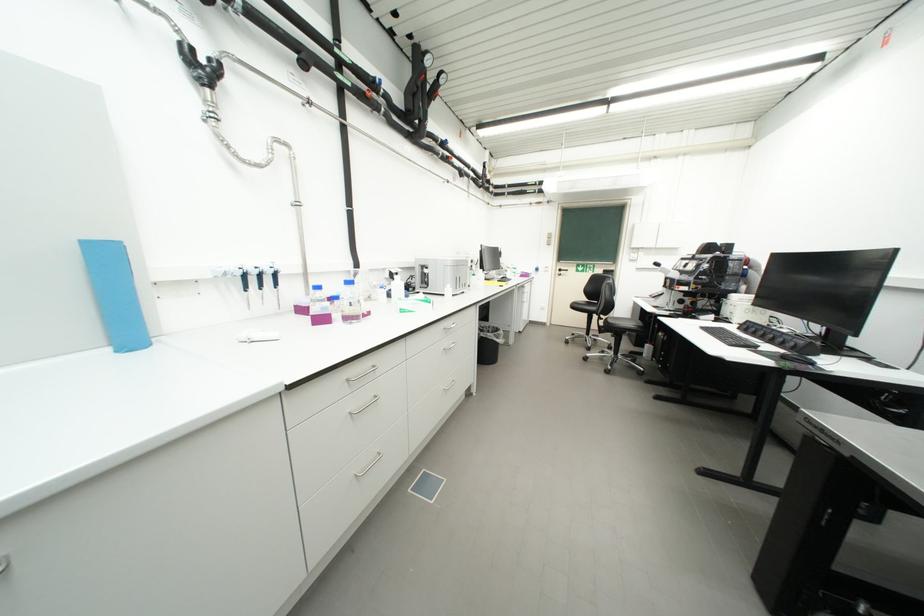
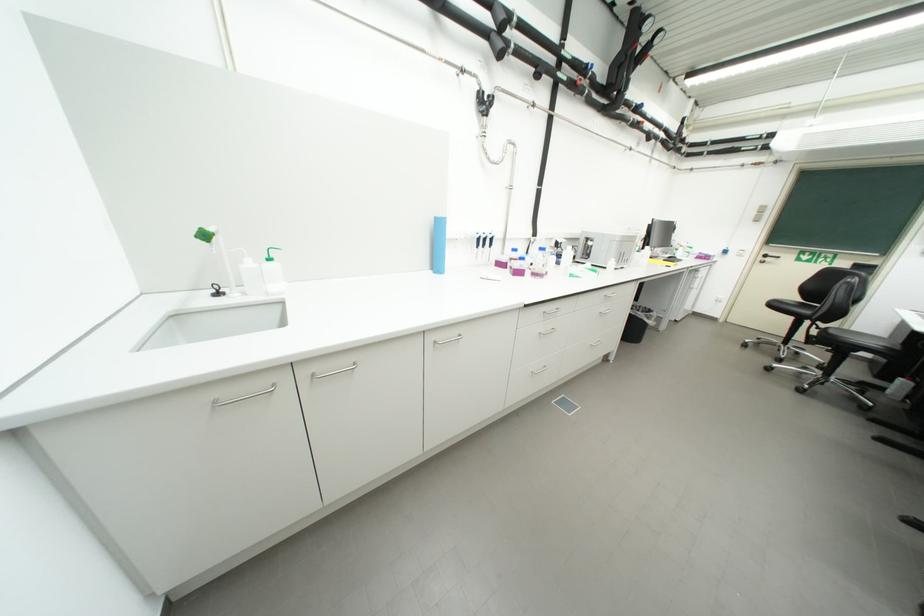
Find the pixel in the second image that matches the point at 355,320 in the first image.

(541, 276)